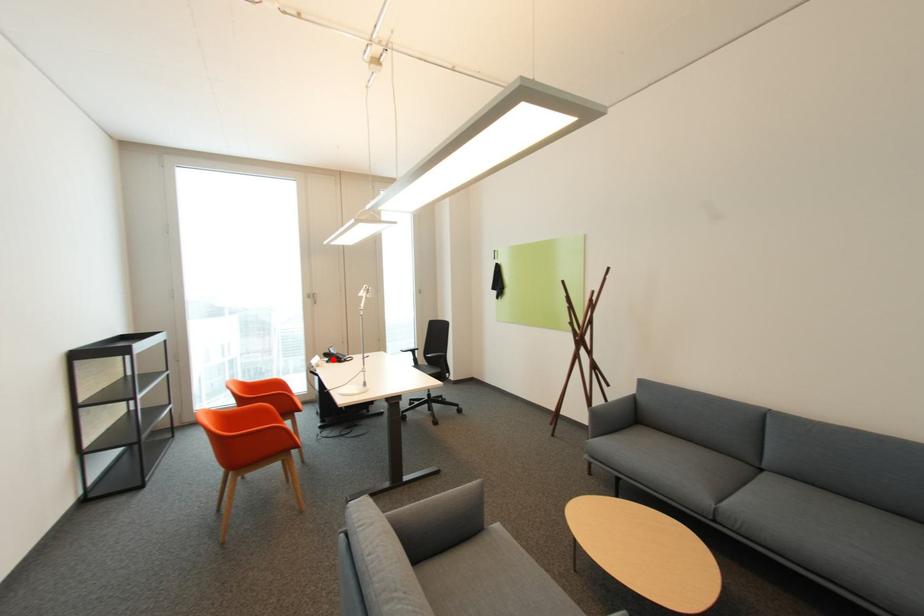
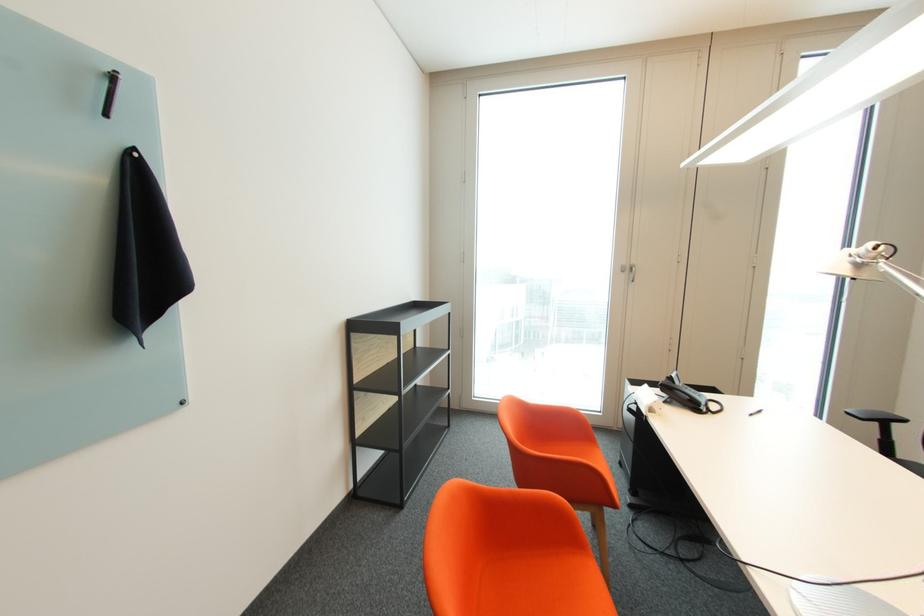
The point at the highlighted location is marked in the first image. Where is the corresponding point in the second image?

(673, 397)